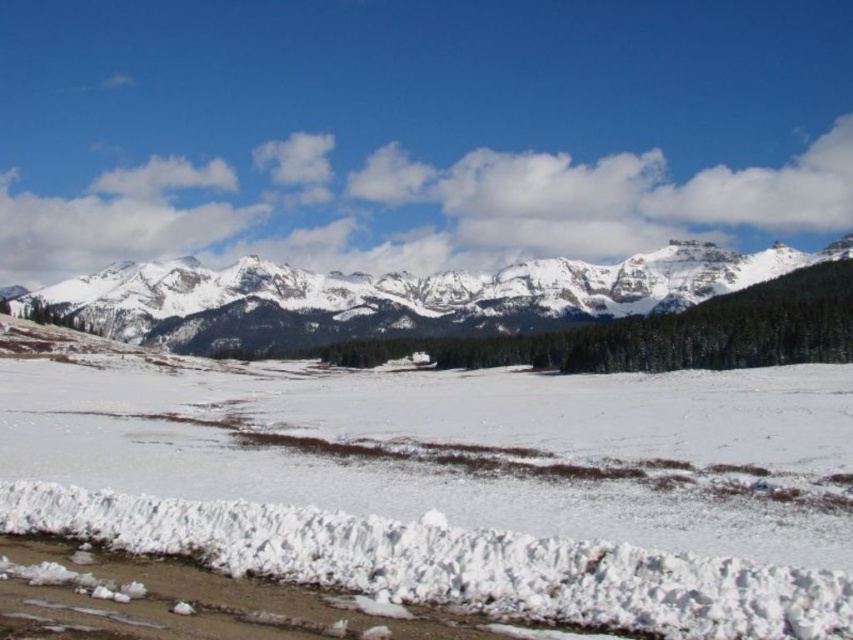
Question: Does white snow at center appear on the right side of white snow-covered mountain range at upper center?

Choices:
 (A) no
 (B) yes

Answer: (A)

Question: Among these points, which one is farthest from the camera?

Choices:
 (A) (239, 508)
 (B) (772, 266)

Answer: (B)

Question: Does white snow at center appear over white snow-covered mountain range at upper center?

Choices:
 (A) yes
 (B) no

Answer: (B)

Question: Is white snow at center closer to camera compared to white snow-covered mountain range at upper center?

Choices:
 (A) yes
 (B) no

Answer: (A)

Question: Which point is farther to the camera?

Choices:
 (A) (164, 524)
 (B) (73, 316)

Answer: (B)